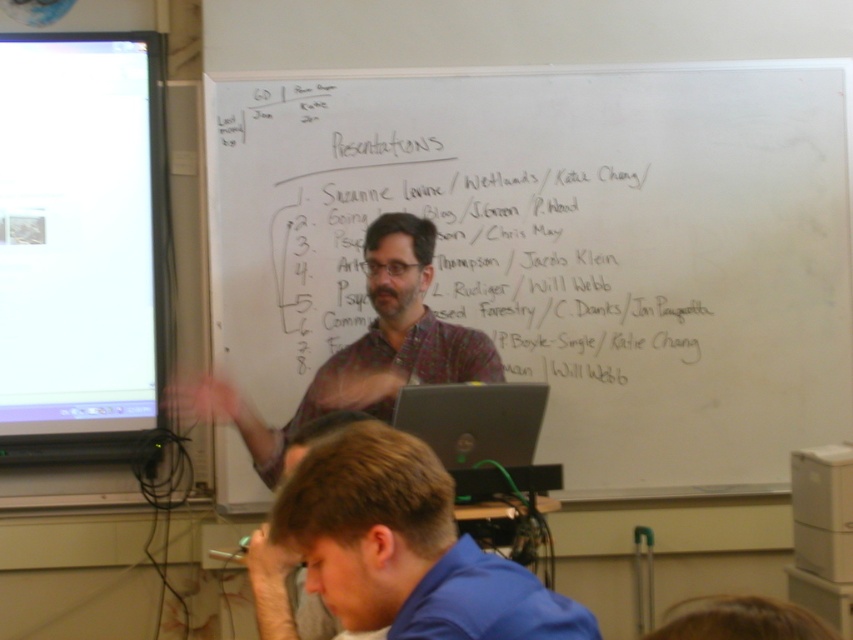
Question: Is blue fabric shirt at lower center below silver metallic laptop at center?

Choices:
 (A) yes
 (B) no

Answer: (A)

Question: Is whiteboard at center wider than blue fabric shirt at lower center?

Choices:
 (A) yes
 (B) no

Answer: (A)

Question: Does white glossy projector screen at left have a larger size compared to silver metallic laptop at center?

Choices:
 (A) yes
 (B) no

Answer: (A)

Question: Which of the following is the farthest from the observer?

Choices:
 (A) whiteboard at center
 (B) patterned fabric shirt at center
 (C) white glossy projector screen at left

Answer: (C)

Question: Which object appears farthest from the camera in this image?

Choices:
 (A) white glossy projector screen at left
 (B) silver metallic laptop at center
 (C) blue fabric shirt at lower center
 (D) patterned fabric shirt at center

Answer: (A)

Question: Which is nearer to the blue fabric shirt at lower center?

Choices:
 (A) patterned fabric shirt at center
 (B) whiteboard at center
 (C) white glossy projector screen at left

Answer: (A)